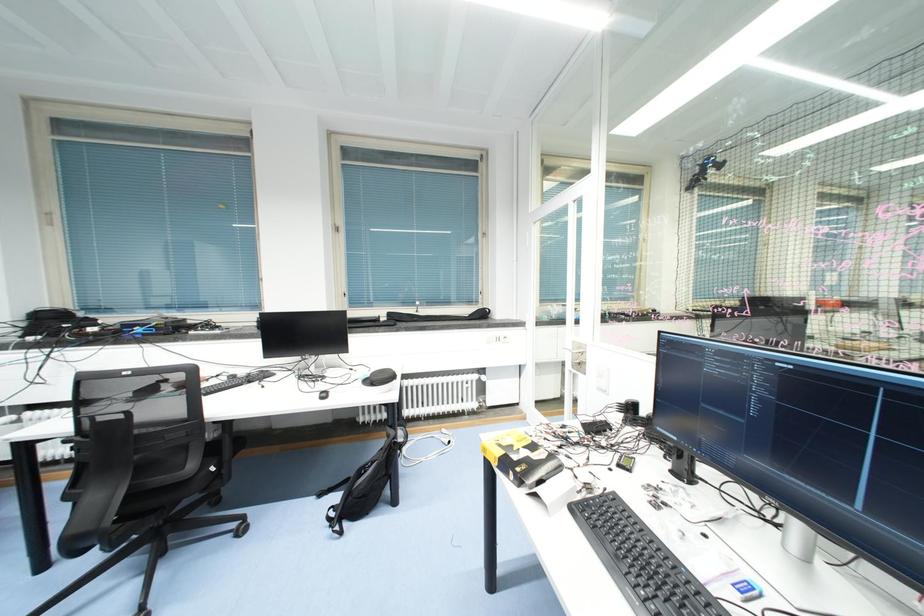
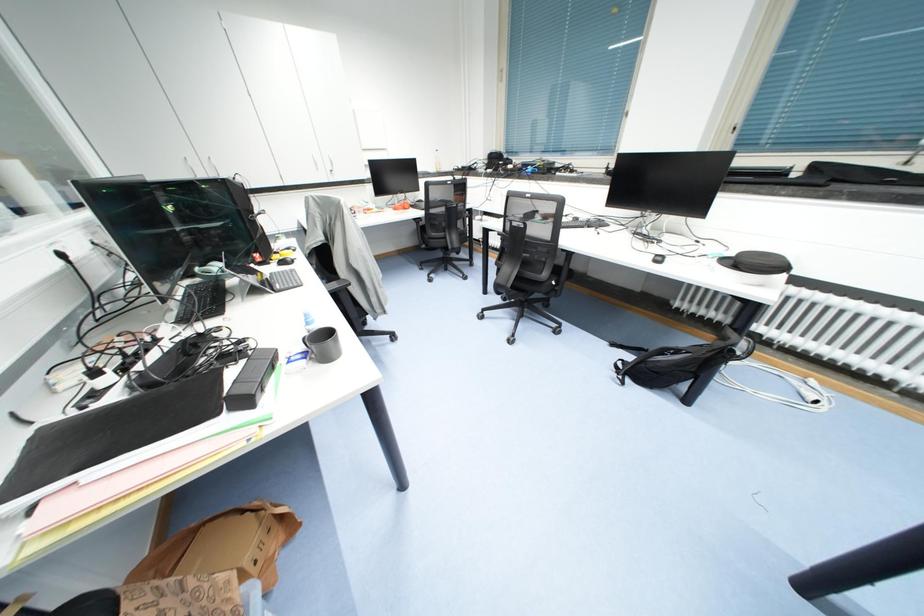
Based on the photo, how did the camera likely rotate?

The rotation direction of the camera is left-down.